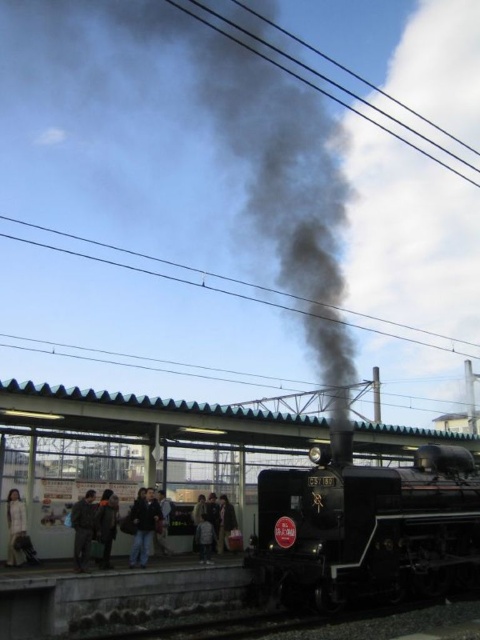
You are standing on the train station platform and see both the light beige jacket at center and the dark gray jacket at lower left. Which jacket is closer to you?

The light beige jacket at center is closer to you because it is further to the viewer than the dark gray jacket at lower left.

You are standing at the train station and want to take a photo of the steam locomotive. The camera you are using has a focal length of 50mm and an aperture of f2.8. If you are positioned at point (136, 536), which is 19.43 meters away from the camera, what is the approximate size of the locomotive in the photo?

The distance of point (136, 536) from camera is 19.43 meters. To calculate the size of the locomotive in the photo, you would need to know the actual size of the locomotive and use the formula for perspective projection. However, since the actual dimensions are not provided, an exact size cannot be determined. The answer would depend on those specifics.

You are a photographer at the train station. You want to take a photo that includes both the dark blue jeans at center and the dark gray jacket at lower left. Which object should you focus on first to ensure both are in frame?

You should focus on the dark blue jeans at center first because it is much taller than the dark gray jacket at lower left, so adjusting the camera angle to include its height will naturally include the shorter jacket in the frame.